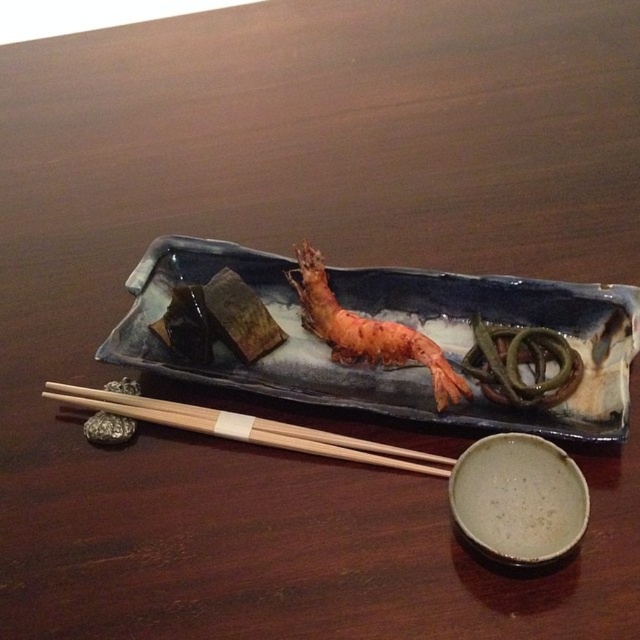
Is point (241, 250) less distant than point (208, 408)?

No, (241, 250) is further to viewer.

Who is more forward, (432, 291) or (204, 432)?

Point (204, 432)

Locate an element on the screen. The height and width of the screenshot is (640, 640). blue ceramic tray at center is located at coordinates (397, 321).

Is wooden chopsticks at lower left positioned before shiny orange shrimp at center?

Yes, it is.

Describe the element at coordinates (248, 428) in the screenshot. Image resolution: width=640 pixels, height=640 pixels. I see `wooden chopsticks at lower left` at that location.

This screenshot has height=640, width=640. Identify the location of wooden chopsticks at lower left. (248, 428).

Does point (636, 314) come behind point (376, 362)?

No, (636, 314) is closer to viewer.

Which is in front, point (410, 288) or point (416, 330)?

Point (416, 330) is in front.

At what (x,y) coordinates should I click in order to perform the action: click on blue ceramic tray at center. Please return your answer as a coordinate pair (x, y). Looking at the image, I should click on (397, 321).